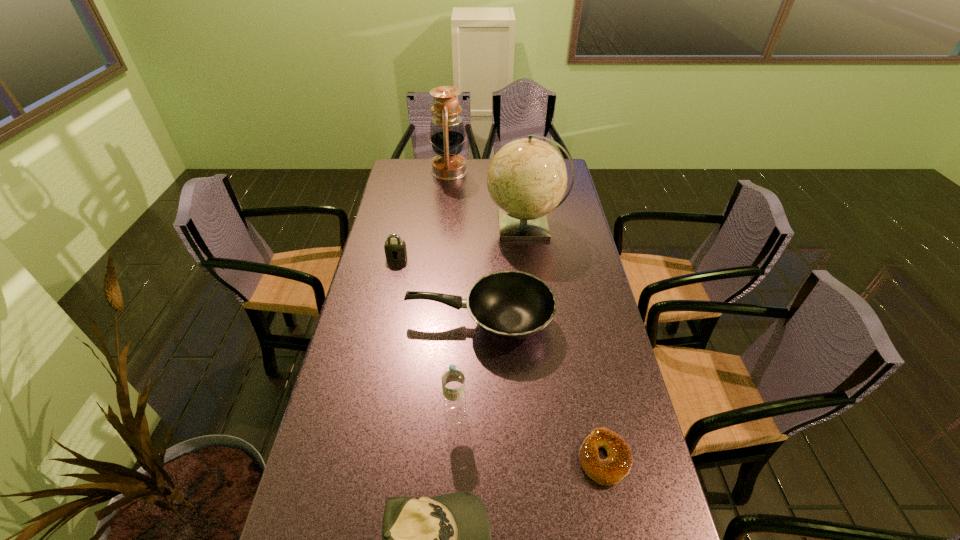
The image size is (960, 540). What are the coordinates of `oil lamp` in the screenshot? It's located at (447, 134).

Locate an element on the screen. This screenshot has width=960, height=540. the sixth nearest object is located at coordinates (527, 178).

Where is `the fifth shortest object`? The width and height of the screenshot is (960, 540). the fifth shortest object is located at coordinates (453, 377).

In order to click on the fifth farthest object in this screenshot , I will do `click(453, 377)`.

Identify the location of the fourth farthest object. The image size is (960, 540). (512, 305).

Identify the location of the leftmost object. (397, 247).

You are a GUI agent. You are given a task and a screenshot of the screen. Output one action in this format:
    pyautogui.click(x=<x>, y=<y>)
    Task: Click on the third farthest object
    This screenshot has height=540, width=960.
    Given the screenshot: What is the action you would take?
    pyautogui.click(x=397, y=247)

You are a GUI agent. You are given a task and a screenshot of the screen. Output one action in this format:
    pyautogui.click(x=<x>, y=<y>)
    Task: Click on the shortest object
    This screenshot has height=540, width=960.
    Given the screenshot: What is the action you would take?
    (x=616, y=466)

I want to click on the second nearest object, so click(x=616, y=466).

What are the coordinates of `vacant space situated on the right of the farthest object` in the screenshot? It's located at (495, 171).